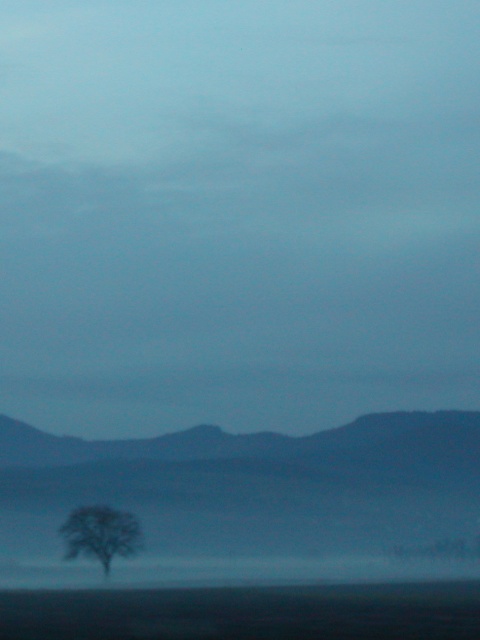
Who is higher up, dark gray textured mountain at lower left or silvery gray tree at lower left?

dark gray textured mountain at lower left is above.

Is dark gray textured mountain at lower left to the left of silvery gray tree at lower left from the viewer's perspective?

Incorrect, dark gray textured mountain at lower left is not on the left side of silvery gray tree at lower left.

Is point (38, 488) positioned behind point (101, 564)?

Yes, point (38, 488) is behind point (101, 564).

Identify the location of dark gray textured mountain at lower left. (244, 497).